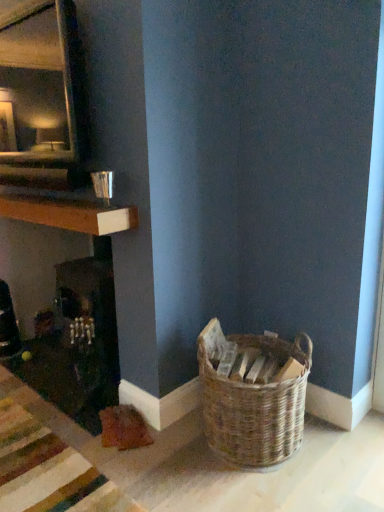
The width and height of the screenshot is (384, 512). What do you see at coordinates (69, 214) in the screenshot?
I see `wooden at left` at bounding box center [69, 214].

Measure the distance between wooden at left and camera.

A distance of 1.96 meters exists between wooden at left and camera.

Where is `wooden at left`? wooden at left is located at coordinates (x=69, y=214).

The image size is (384, 512). What do you see at coordinates (253, 394) in the screenshot? I see `woven brown basket at lower right` at bounding box center [253, 394].

In order to face woven brown basket at lower right, should I rotate leftwards or rightwards?

It's best to rotate right around 8.170 degrees.

Locate an element on the screen. The width and height of the screenshot is (384, 512). woven brown basket at lower right is located at coordinates (253, 394).

Where is `wooden at left`? This screenshot has width=384, height=512. wooden at left is located at coordinates (69, 214).

Is woven brown basket at lower right to the left or to the right of wooden at left in the image?

woven brown basket at lower right is positioned on wooden at left's right side.

Considering their positions, is woven brown basket at lower right located in front of or behind wooden at left?

Clearly, woven brown basket at lower right is in front of wooden at left.

Based on the photo, which point is more forward, (235, 369) or (62, 228)?

Point (235, 369)

From the image's perspective, which is above, woven brown basket at lower right or wooden at left?

wooden at left appears higher in the image.

Consider the image. From a real-world perspective, between woven brown basket at lower right and wooden at left, who is vertically higher?

In real-world perspective, wooden at left is above.

Between woven brown basket at lower right and wooden at left, which one has smaller width?

Thinner between the two is wooden at left.

Considering the relative sizes of woven brown basket at lower right and wooden at left in the image provided, is woven brown basket at lower right shorter than wooden at left?

In fact, woven brown basket at lower right may be taller than wooden at left.

Which of these two, woven brown basket at lower right or wooden at left, is smaller?

With smaller size is wooden at left.

Looking at this image, is woven brown basket at lower right completely or partially outside of wooden at left?

Yes, woven brown basket at lower right is located beyond the bounds of wooden at left.

Is woven brown basket at lower right not close to wooden at left?

No, there isn't a large distance between woven brown basket at lower right and wooden at left.

Could you tell me if woven brown basket at lower right is facing wooden at left?

No, woven brown basket at lower right is not facing towards wooden at left.

This screenshot has width=384, height=512. What are the coordinates of `picnic basket below the wooden at left (from the image's perspective)` in the screenshot? It's located at (253, 394).

Which is more to the right, wooden at left or woven brown basket at lower right?

From the viewer's perspective, woven brown basket at lower right appears more on the right side.

Is wooden at left behind woven brown basket at lower right?

Yes, it is behind woven brown basket at lower right.

Is point (85, 213) farther from viewer compared to point (250, 441)?

Yes, point (85, 213) is behind point (250, 441).

From the image's perspective, is wooden at left under woven brown basket at lower right?

Incorrect, from the image's perspective, wooden at left is higher than woven brown basket at lower right.

From a real-world perspective, which is physically below, wooden at left or woven brown basket at lower right?

In real-world perspective, woven brown basket at lower right is lower.

Considering the sizes of wooden at left and woven brown basket at lower right in the image, is wooden at left wider or thinner than woven brown basket at lower right?

In the image, wooden at left appears to be more narrow than woven brown basket at lower right.

Which of these two, wooden at left or woven brown basket at lower right, stands taller?

With more height is woven brown basket at lower right.

Which of these two, wooden at left or woven brown basket at lower right, is smaller?

Smaller between the two is wooden at left.

Would you say wooden at left is inside or outside woven brown basket at lower right?

wooden at left cannot be found inside woven brown basket at lower right.

Is wooden at left not close to woven brown basket at lower right?

wooden at left is actually quite close to woven brown basket at lower right.

Could you tell me if wooden at left is turned towards woven brown basket at lower right?

No, wooden at left does not turn towards woven brown basket at lower right.

Looking at this image, how far apart are wooden at left and woven brown basket at lower right?

wooden at left is 97.33 centimeters from woven brown basket at lower right.

At what (x,y) coordinates should I click in order to perform the action: click on picnic basket on the right of wooden at left. Please return your answer as a coordinate pair (x, y). This screenshot has height=512, width=384. Looking at the image, I should click on (253, 394).

The width and height of the screenshot is (384, 512). I want to click on shelf located above the woven brown basket at lower right (from the image's perspective), so click(x=69, y=214).

The width and height of the screenshot is (384, 512). I want to click on picnic basket in front of the wooden at left, so click(x=253, y=394).